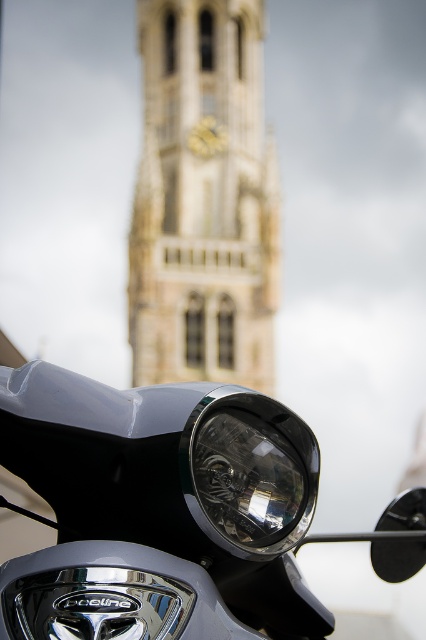
You are a photographer trying to capture the motorcycle and the clock tower in a single shot. Given that the satin silver headlight at center and the stone clock tower at center are in your frame, which object appears taller in the photo?

The stone clock tower at center appears taller than the satin silver headlight at center in the photo because the satin silver headlight at center has a lesser height compared to the stone clock tower at center.

You are a photographer trying to capture the motorcycle and the clock tower in the same frame. Given that the satin silver headlight at center and the stone clock tower at center are both in focus, which object would appear larger in your photo?

The satin silver headlight at center would appear larger in the photo because it is closer to the camera than the stone clock tower at center.

You are standing in front of the motorcycle and want to take a photo of the stone clock tower at center. Considering the distance between you and the tower, can you capture the entire tower in one shot without moving your position?

The stone clock tower at center and camera are 113.74 meters apart from each other. Depending on the camera lens used, capturing the entire tower in one shot may require a wide angle lens. However, the exact feasibility depends on the camera equipment available.